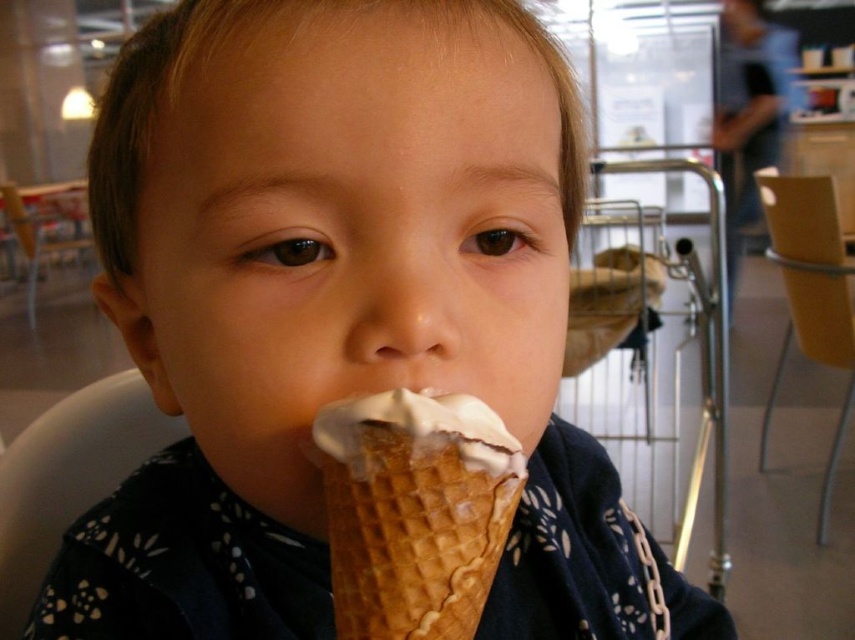
Question: Does waffle cone ice cream at mouth appear under brown leather chair at left?

Choices:
 (A) yes
 (B) no

Answer: (A)

Question: Is waffle cone ice cream at mouth to the right of white plastic chair at lower left from the viewer's perspective?

Choices:
 (A) no
 (B) yes

Answer: (B)

Question: Considering the real-world distances, which object is farthest from the brown leather chair at left?

Choices:
 (A) waffle cone ice cream at mouth
 (B) white plastic chair at lower left

Answer: (A)

Question: Which point appears closest to the camera in this image?

Choices:
 (A) (68, 484)
 (B) (66, 218)
 (C) (827, 348)

Answer: (A)

Question: Can you confirm if waffle cone ice cream at mouth is positioned to the left of white plastic chair at lower left?

Choices:
 (A) yes
 (B) no

Answer: (B)

Question: Which of the following is the farthest from the observer?

Choices:
 (A) (122, 435)
 (B) (33, 250)
 (C) (764, 422)

Answer: (B)